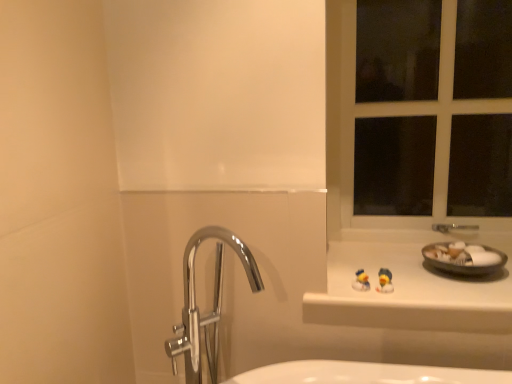
Identify the location of free space to the back side of blue rubber duck at center, marked as the 2th miniature in a right-to-left arrangement. The width and height of the screenshot is (512, 384). (352, 273).